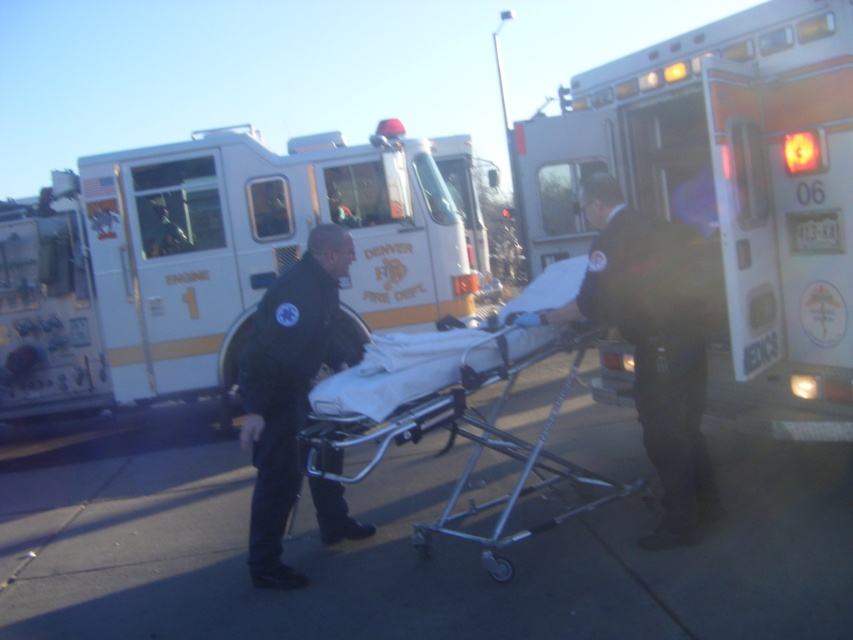
Question: Which is farther from the metallic silver stretcher at center?

Choices:
 (A) white glossy fire truck at center
 (B) silver metallic ambulance at right
 (C) black fabric suit at center
 (D) black matte uniform at center

Answer: (A)

Question: Which point is farther to the camera?

Choices:
 (A) (694, 326)
 (B) (277, 451)
 (C) (183, 184)
 (D) (624, 156)

Answer: (C)

Question: Where is white glossy fire truck at center located in relation to metallic silver stretcher at center in the image?

Choices:
 (A) above
 (B) below

Answer: (A)

Question: Which point appears farthest from the camera in this image?

Choices:
 (A) (418, 298)
 (B) (285, 566)

Answer: (A)

Question: Is silver metallic ambulance at right positioned at the back of metallic silver stretcher at center?

Choices:
 (A) no
 (B) yes

Answer: (B)

Question: Considering the relative positions of white glossy fire truck at center and silver metallic ambulance at right in the image provided, where is white glossy fire truck at center located with respect to silver metallic ambulance at right?

Choices:
 (A) above
 (B) below

Answer: (A)